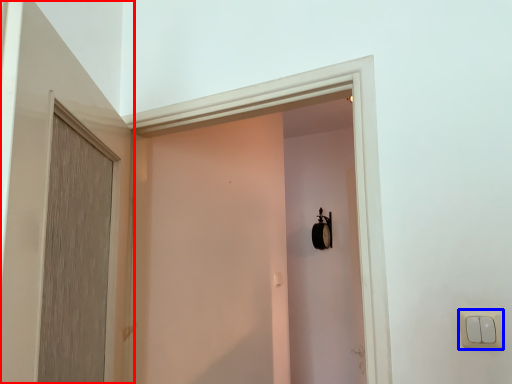
Question: Which object appears farthest to the camera in this image, door (highlighted by a red box) or light switch (highlighted by a blue box)?

Choices:
 (A) door
 (B) light switch

Answer: (B)